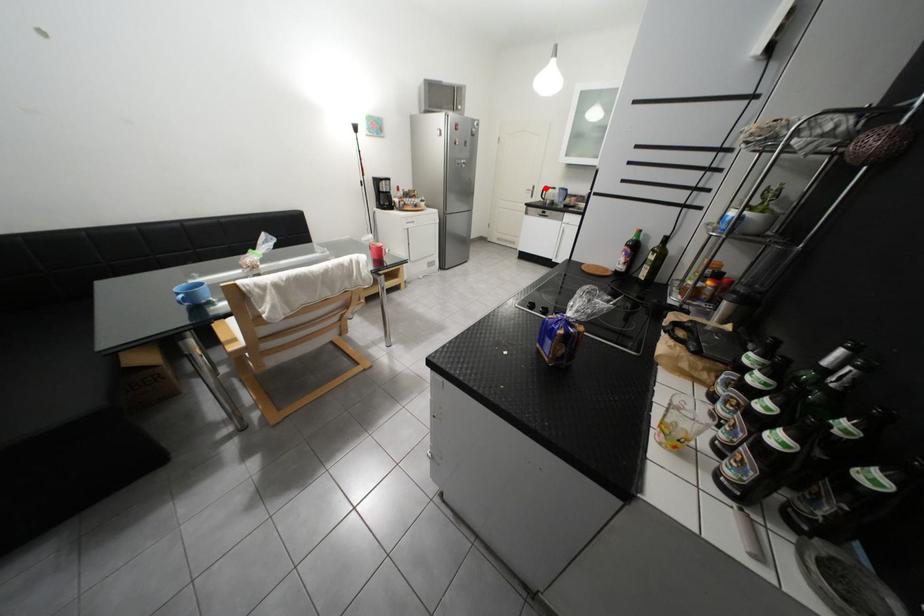
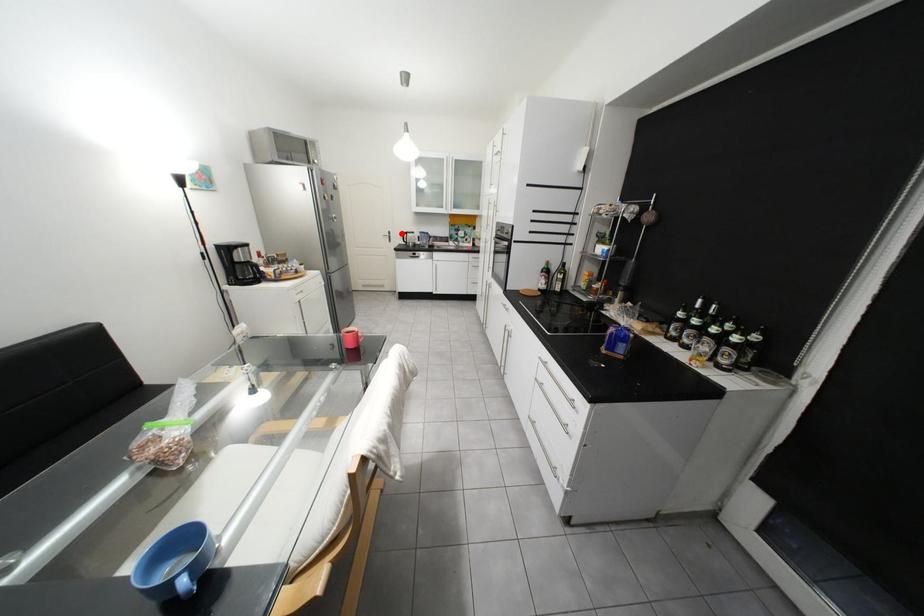
I am providing you with two images of the same scene from different viewpoints. A red point is marked on the first image and another point is marked on the second image. Is the marked point in image1 the same physical position as the marked point in image2?

Yes